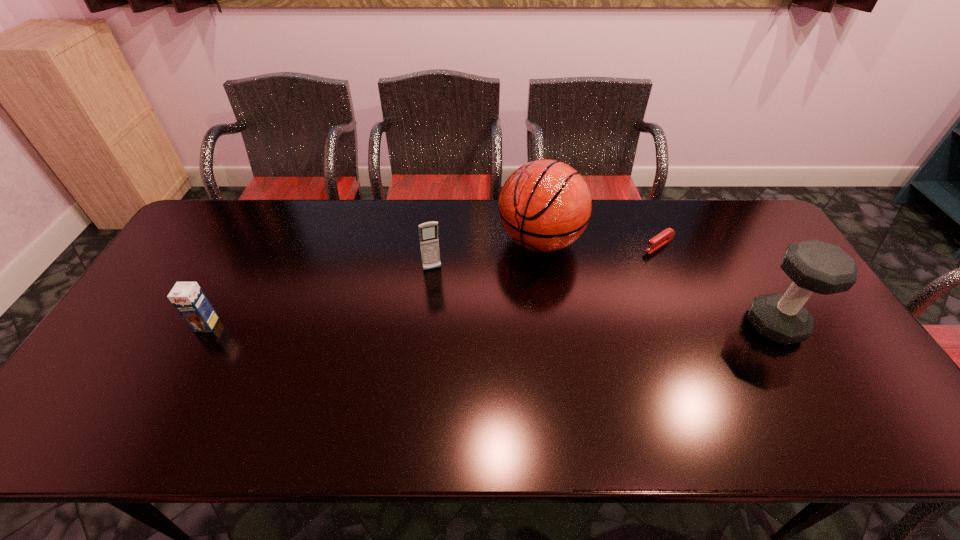
Locate an element on the screen. stapler located at the far edge is located at coordinates (665, 236).

Where is `object present at the right edge`? object present at the right edge is located at coordinates (814, 266).

The height and width of the screenshot is (540, 960). I want to click on vacant area at the far edge, so click(294, 240).

You are a GUI agent. You are given a task and a screenshot of the screen. Output one action in this format:
    pyautogui.click(x=<x>, y=<y>)
    Task: Click on the free space at the near edge
    
    Given the screenshot: What is the action you would take?
    pyautogui.click(x=717, y=386)

Locate an element on the screen. free region at the left edge of the desktop is located at coordinates (158, 303).

Where is `vacant space at the far left corner`? Image resolution: width=960 pixels, height=540 pixels. vacant space at the far left corner is located at coordinates pyautogui.click(x=214, y=233).

Identify the location of vacant area at the far right corner of the desktop. (726, 240).

Where is `unoccupied area between the cellular telephone and the rightmost object`? unoccupied area between the cellular telephone and the rightmost object is located at coordinates (604, 297).

Locate an element on the screen. Image resolution: width=960 pixels, height=540 pixels. free spot between the stapler and the third shortest object is located at coordinates (545, 257).

Where is `vacant area that lies between the fourth object from right to left and the shortest object`? This screenshot has height=540, width=960. vacant area that lies between the fourth object from right to left and the shortest object is located at coordinates pos(545,257).